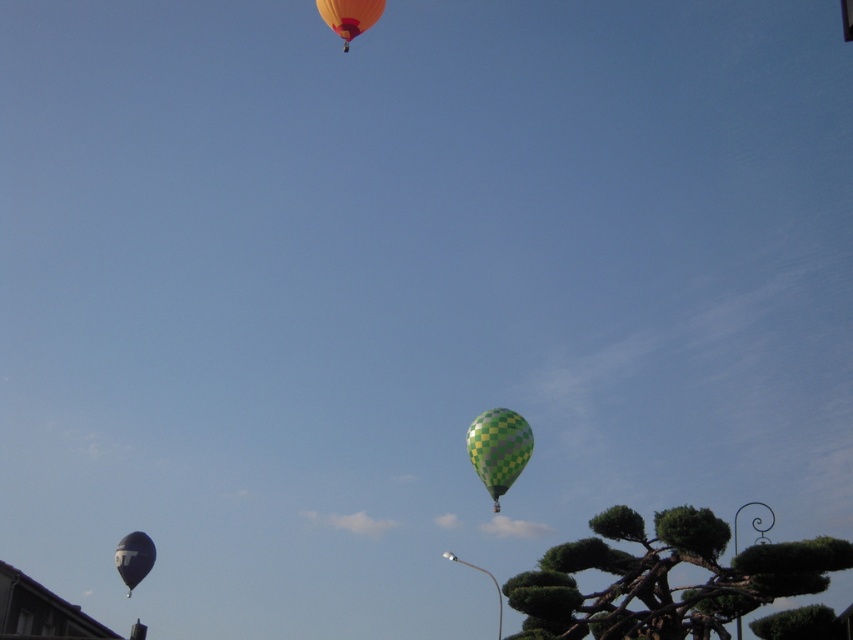
Is the position of green checkered balloon at center less distant than that of matte black balloon at lower left?

No, green checkered balloon at center is behind matte black balloon at lower left.

Who is positioned more to the right, green checkered balloon at center or matte black balloon at lower left?

green checkered balloon at center is more to the right.

Which is in front, point (505, 488) or point (138, 536)?

Point (138, 536) is more forward.

Find the location of a particular element. green checkered balloon at center is located at coordinates (498, 449).

Is point (350, 38) positioned in front of point (151, 554)?

No, it is not.

Describe the element at coordinates (349, 16) in the screenshot. Image resolution: width=853 pixels, height=640 pixels. I see `orange glossy balloon at upper center` at that location.

Between point (347, 26) and point (131, 573), which one is positioned in front?

Point (131, 573)

The image size is (853, 640). Find the location of `orange glossy balloon at upper center`. orange glossy balloon at upper center is located at coordinates (349, 16).

Between green checkered tree at lower right and green checkered balloon at center, which one appears on the right side from the viewer's perspective?

From the viewer's perspective, green checkered tree at lower right appears more on the right side.

Describe the element at coordinates (664, 579) in the screenshot. I see `green checkered tree at lower right` at that location.

This screenshot has height=640, width=853. What do you see at coordinates (664, 579) in the screenshot?
I see `green checkered tree at lower right` at bounding box center [664, 579].

You are a GUI agent. You are given a task and a screenshot of the screen. Output one action in this format:
    pyautogui.click(x=<x>, y=<y>)
    Task: Click on the green checkered tree at lower right
    This screenshot has height=640, width=853.
    Given the screenshot: What is the action you would take?
    pyautogui.click(x=664, y=579)